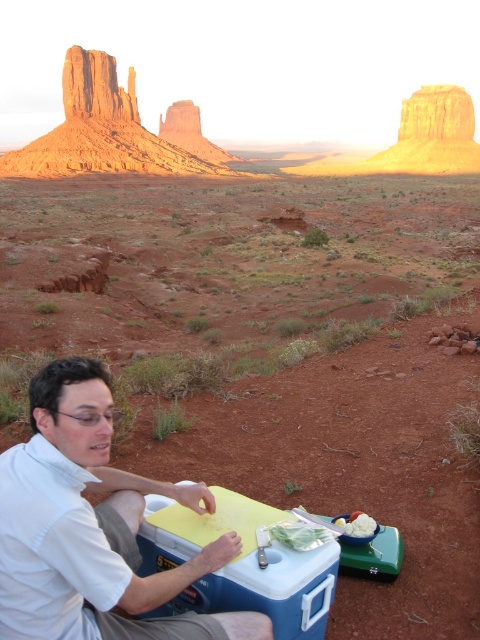
Question: Which point is farther to the camera?

Choices:
 (A) (349, 522)
 (B) (220, 522)
 (C) (269, 620)

Answer: (A)

Question: Which of the following is the farthest from the observer?

Choices:
 (A) white fluffy ice cream at lower center
 (B) white matte shirt at lower left
 (C) blue plastic cooler at lower center

Answer: (A)

Question: Considering the relative positions of white matte shirt at lower left and white fluffy ice cream at lower center in the image provided, where is white matte shirt at lower left located with respect to white fluffy ice cream at lower center?

Choices:
 (A) below
 (B) above

Answer: (B)

Question: Is blue plastic cooler at lower center below white fluffy ice cream at lower center?

Choices:
 (A) yes
 (B) no

Answer: (A)

Question: Which object is positioned farthest from the blue plastic cooler at lower center?

Choices:
 (A) white fluffy ice cream at lower center
 (B) white matte shirt at lower left

Answer: (A)

Question: Can you confirm if white matte shirt at lower left is positioned to the left of blue plastic cooler at lower center?

Choices:
 (A) no
 (B) yes

Answer: (B)